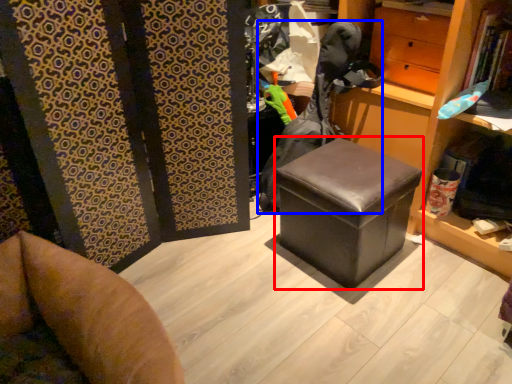
Question: Among these objects, which one is nearest to the camera, stool (highlighted by a red box) or clothing (highlighted by a blue box)?

Choices:
 (A) stool
 (B) clothing

Answer: (A)